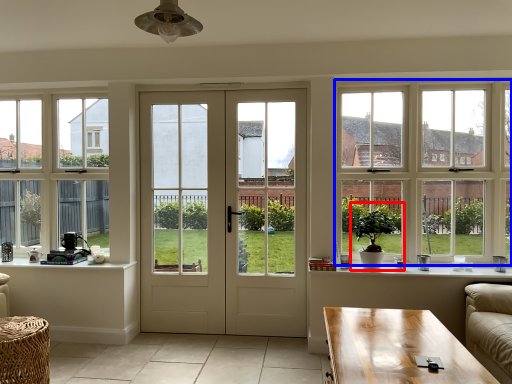
Question: Which point is closer to the camera, houseplant (highlighted by a red box) or window (highlighted by a blue box)?

Choices:
 (A) houseplant
 (B) window

Answer: (A)